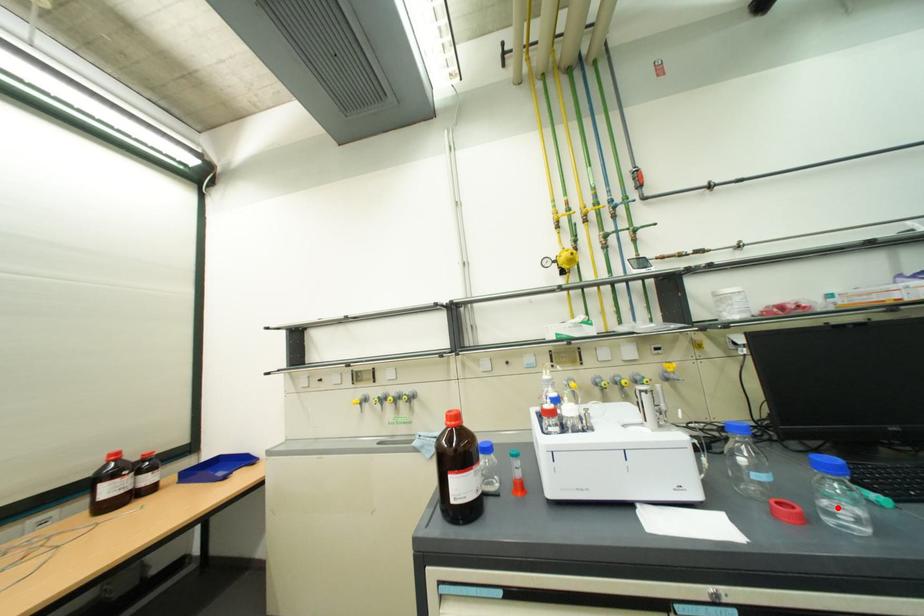
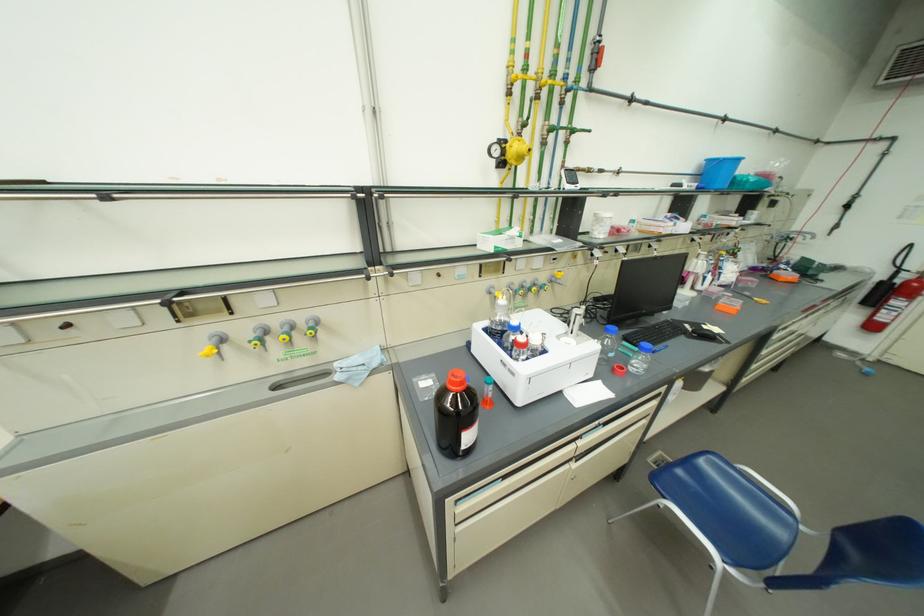
Question: I am providing you with two images of the same scene from different viewpoints. A red point is shown in image1. For the corresponding object point in image2, is it positioned nearer or farther from the camera?

Choices:
 (A) Nearer
 (B) Farther

Answer: (B)